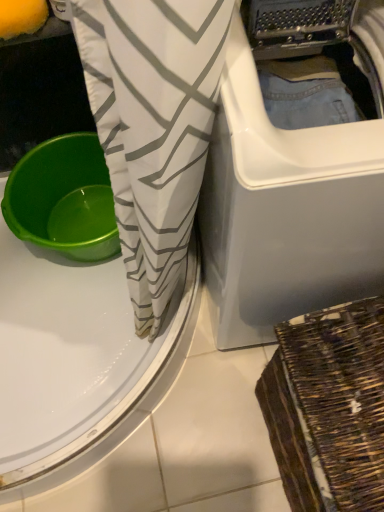
Question: Considering the relative positions of green plastic basin at left and white plastic washing machine at center in the image provided, is green plastic basin at left to the left of white plastic washing machine at center from the viewer's perspective?

Choices:
 (A) no
 (B) yes

Answer: (B)

Question: Can we say green plastic basin at left lies outside white plastic washing machine at center?

Choices:
 (A) no
 (B) yes

Answer: (B)

Question: From a real-world perspective, is green plastic basin at left positioned over white plastic washing machine at center based on gravity?

Choices:
 (A) no
 (B) yes

Answer: (A)

Question: Is green plastic basin at left in front of white plastic washing machine at center?

Choices:
 (A) no
 (B) yes

Answer: (A)

Question: Does green plastic basin at left turn towards white plastic washing machine at center?

Choices:
 (A) no
 (B) yes

Answer: (A)

Question: From a real-world perspective, is green plastic basin at left positioned above or below white fabric with gray zigzag pattern at center?

Choices:
 (A) below
 (B) above

Answer: (A)

Question: From their relative heights in the image, would you say green plastic basin at left is taller or shorter than white fabric with gray zigzag pattern at center?

Choices:
 (A) short
 (B) tall

Answer: (A)

Question: In terms of size, does green plastic basin at left appear bigger or smaller than white fabric with gray zigzag pattern at center?

Choices:
 (A) big
 (B) small

Answer: (B)

Question: Is point (44, 208) positioned closer to the camera than point (140, 93)?

Choices:
 (A) closer
 (B) farther

Answer: (B)

Question: From a real-world perspective, is woven brown basket at lower right above or below white plastic washing machine at center?

Choices:
 (A) above
 (B) below

Answer: (B)

Question: Is woven brown basket at lower right to the left or to the right of white plastic washing machine at center in the image?

Choices:
 (A) right
 (B) left

Answer: (A)

Question: Which is correct: woven brown basket at lower right is inside white plastic washing machine at center, or outside of it?

Choices:
 (A) inside
 (B) outside

Answer: (B)

Question: In terms of height, does woven brown basket at lower right look taller or shorter compared to white plastic washing machine at center?

Choices:
 (A) short
 (B) tall

Answer: (A)

Question: Visually, is white plastic washing machine at center positioned to the left or to the right of white fabric with gray zigzag pattern at center?

Choices:
 (A) right
 (B) left

Answer: (A)

Question: From the image's perspective, is white plastic washing machine at center positioned above or below white fabric with gray zigzag pattern at center?

Choices:
 (A) below
 (B) above

Answer: (B)